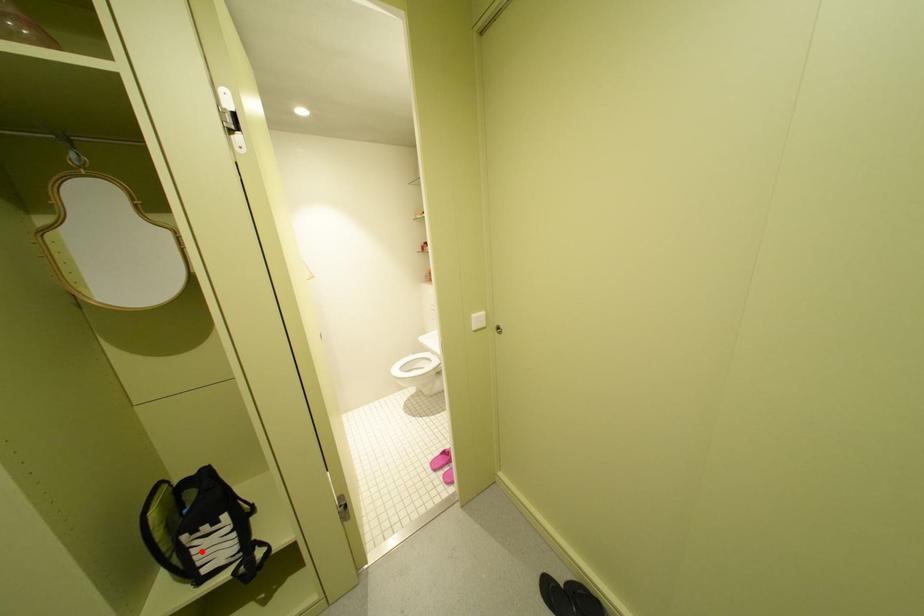
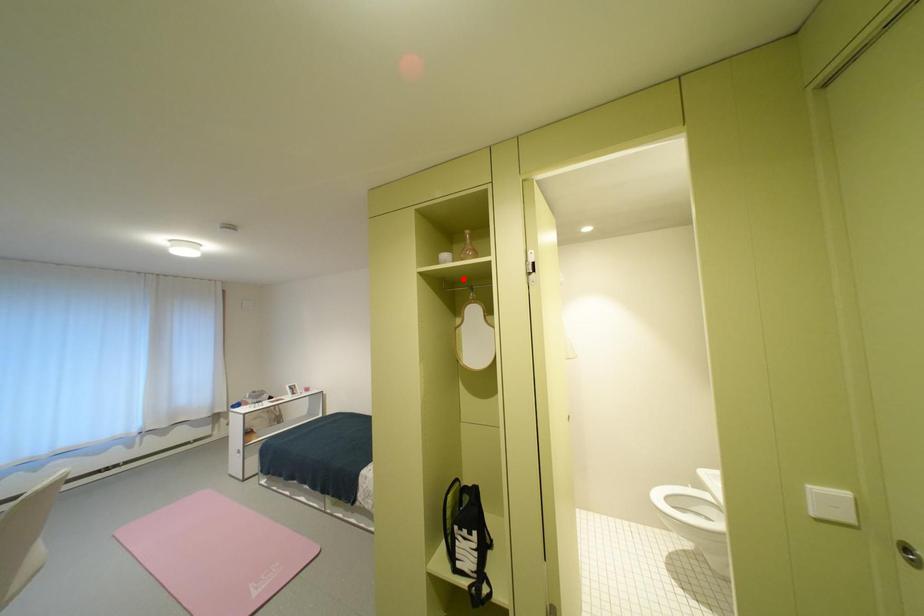
I am providing you with two images of the same scene from different viewpoints. A red point is marked on the first image and another point is marked on the second image. Are the points marked in image1 and image2 representing the same 3D position?

No